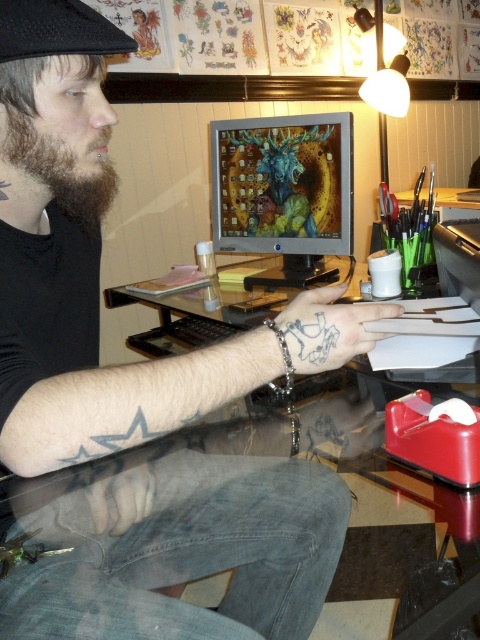
You are standing in the studio and need to place a new object on the transparent glass desk at center. Where exactly should you place it?

The transparent glass desk at center is located at the 2D coordinates point (373, 509), so you should place the new object there.

You are a photographer taking a closeup shot of the person in the scene. You need to focus on the brown fuzzy beard at left and the blue ink tattoo at upper center. Which object is positioned higher on the person?

The brown fuzzy beard at left is located above the blue ink tattoo at upper center, so the brown fuzzy beard at left is positioned higher on the person.

You are trying to locate the transparent glass desk at center in the workspace. According to the coordinates provided, where exactly is it positioned?

The transparent glass desk at center is positioned at point (373,509).